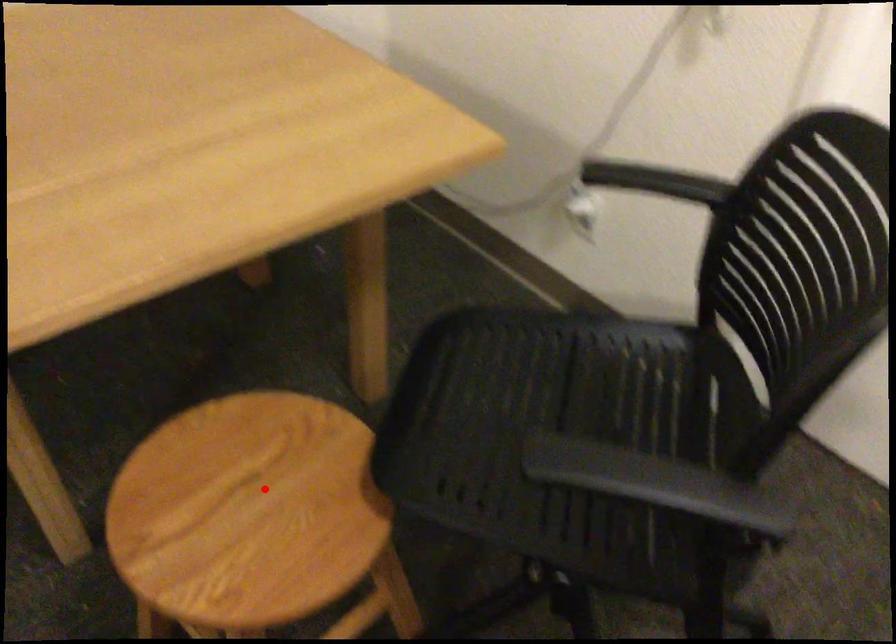
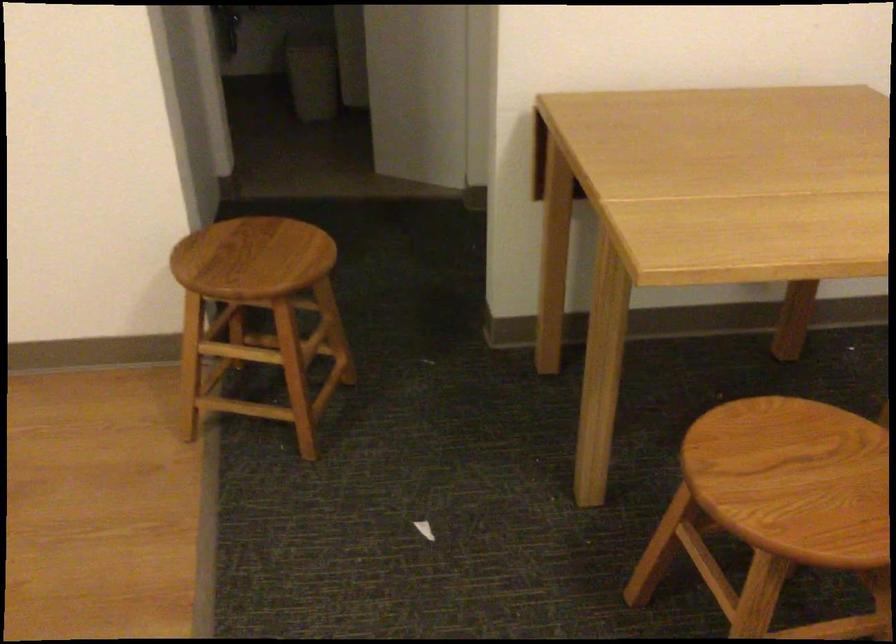
Question: A red point is marked in image1. In image2, is the corresponding 3D point closer to the camera or farther? Reply with the corresponding letter.

Choices:
 (A) The corresponding 3D point is closer.
 (B) The corresponding 3D point is farther.

Answer: (B)